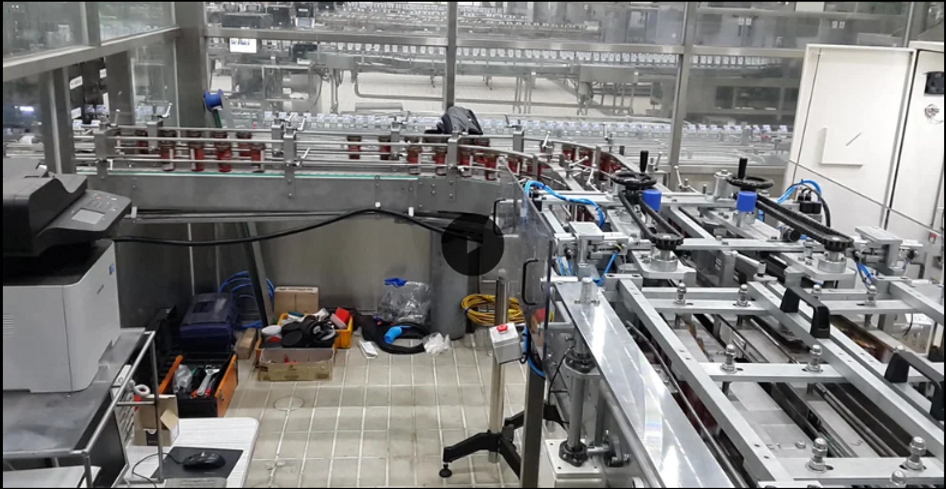
You are a GUI agent. You are given a task and a screenshot of the screen. Output one action in this format:
    pyautogui.click(x=<x>, y=<y>)
    Task: Click on the tile floor
    The image size is (946, 489).
    Given the screenshot: What is the action you would take?
    pyautogui.click(x=341, y=425)